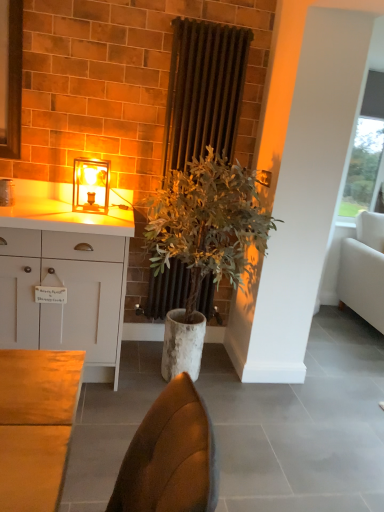
You are a GUI agent. You are given a task and a screenshot of the screen. Output one action in this format:
    pyautogui.click(x=<x>, y=<y>)
    Task: Click on the dark brown radiator at center
    This screenshot has width=384, height=512.
    Given the screenshot: What is the action you would take?
    pyautogui.click(x=203, y=91)

What do you see at coordinates (72, 296) in the screenshot?
I see `white matte cabinet at left` at bounding box center [72, 296].

You are a GUI agent. You are given a task and a screenshot of the screen. Output one action in this format:
    pyautogui.click(x=<x>, y=<y>)
    Task: Click on the white fabric couch at right
    The height and width of the screenshot is (512, 384).
    Given the screenshot: What is the action you would take?
    pyautogui.click(x=364, y=269)

Is green leafy plant at center not near dark brown radiator at center?

No, green leafy plant at center is not far from dark brown radiator at center.

Measure the distance from green leafy plant at center to dark brown radiator at center.

46.92 centimeters.

How different are the orientations of green leafy plant at center and dark brown radiator at center in degrees?

125 degrees separate the facing orientations of green leafy plant at center and dark brown radiator at center.

From the image's perspective, who appears lower, green leafy plant at center or dark brown radiator at center?

green leafy plant at center.

From the image's perspective, which one is positioned lower, dark brown radiator at center or green leafy plant at center?

green leafy plant at center appears lower in the image.

Is dark brown radiator at center facing towards green leafy plant at center?

No, dark brown radiator at center is not aimed at green leafy plant at center.

Between dark brown radiator at center and green leafy plant at center, which one has smaller width?

With smaller width is dark brown radiator at center.

Is dark brown radiator at center closer to camera compared to green leafy plant at center?

No, dark brown radiator at center is behind green leafy plant at center.

Where is `studio couch below the matte glass table lamp at upper left (from a real-world perspective)`? This screenshot has height=512, width=384. studio couch below the matte glass table lamp at upper left (from a real-world perspective) is located at coordinates (364, 269).

Is point (368, 279) behind point (96, 191)?

That is True.

Is the position of white fabric couch at right less distant than that of matte glass table lamp at upper left?

No, white fabric couch at right is further to the viewer.

Measure the distance from white fabric couch at right to matte glass table lamp at upper left.

white fabric couch at right is 7.57 feet away from matte glass table lamp at upper left.

From a real-world perspective, who is located higher, green leafy plant at center or white matte cabinet at left?

In real-world perspective, green leafy plant at center is above.

Is white matte cabinet at left completely or partially inside green leafy plant at center?

No, white matte cabinet at left is located outside of green leafy plant at center.

Who is taller, green leafy plant at center or white matte cabinet at left?

Standing taller between the two is green leafy plant at center.

Does green leafy plant at center turn towards white matte cabinet at left?

No, green leafy plant at center is not facing towards white matte cabinet at left.

From the image's perspective, which one is positioned lower, green leafy plant at center or matte glass table lamp at upper left?

From the image's view, green leafy plant at center is below.

Does point (191, 259) appear closer or farther from the camera than point (80, 187)?

Point (191, 259) is positioned closer to the camera compared to point (80, 187).

Can matte glass table lamp at upper left be found inside green leafy plant at center?

That's incorrect, matte glass table lamp at upper left is not inside green leafy plant at center.

Consider the image. How many degrees apart are the facing directions of green leafy plant at center and matte glass table lamp at upper left?

The facing directions of green leafy plant at center and matte glass table lamp at upper left are 2.8 degrees apart.

In the scene shown: Is white matte cabinet at left surrounded by matte glass table lamp at upper left?

No, white matte cabinet at left is not a part of matte glass table lamp at upper left.

Measure the distance from matte glass table lamp at upper left to white matte cabinet at left.

A distance of 18.96 inches exists between matte glass table lamp at upper left and white matte cabinet at left.

Can you confirm if matte glass table lamp at upper left is positioned to the right of white matte cabinet at left?

Correct, you'll find matte glass table lamp at upper left to the right of white matte cabinet at left.

Locate an element on the screen. cabinetry in front of the matte glass table lamp at upper left is located at coordinates (72, 296).

Which is behind, white matte cabinet at left or green leafy plant at center?

Positioned behind is white matte cabinet at left.

From a real-world perspective, between white matte cabinet at left and green leafy plant at center, who is vertically higher?

green leafy plant at center.

Which is correct: white matte cabinet at left is inside green leafy plant at center, or outside of it?

white matte cabinet at left exists outside the volume of green leafy plant at center.

How far apart are white matte cabinet at left and green leafy plant at center?

white matte cabinet at left is 18.87 inches from green leafy plant at center.

The width and height of the screenshot is (384, 512). I want to click on radiator that is on the left side of green leafy plant at center, so click(203, 91).

Locate an element on the screen. This screenshot has width=384, height=512. houseplant on the right of dark brown radiator at center is located at coordinates (206, 227).

Considering their positions, is white fabric couch at right positioned closer to dark brown radiator at center than matte glass table lamp at upper left?

matte glass table lamp at upper left lies closer to dark brown radiator at center than the other object.

Looking at the image, which one is located closer to green leafy plant at center, white fabric couch at right or dark brown radiator at center?

The object closer to green leafy plant at center is dark brown radiator at center.

Looking at the image, which one is located closer to white matte cabinet at left, dark brown radiator at center or white fabric couch at right?

dark brown radiator at center.

Estimate the real-world distances between objects in this image. Which object is closer to matte glass table lamp at upper left, dark brown radiator at center or white matte cabinet at left?

Among the two, white matte cabinet at left is located nearer to matte glass table lamp at upper left.

Considering their positions, is white matte cabinet at left positioned closer to white fabric couch at right than dark brown radiator at center?

dark brown radiator at center.

Considering their positions, is green leafy plant at center positioned further to dark brown radiator at center than white fabric couch at right?

white fabric couch at right lies further to dark brown radiator at center than the other object.

Looking at the image, which one is located closer to white fabric couch at right, white matte cabinet at left or matte glass table lamp at upper left?

Among the two, matte glass table lamp at upper left is located nearer to white fabric couch at right.

From the image, which object appears to be nearer to white matte cabinet at left, white fabric couch at right or matte glass table lamp at upper left?

matte glass table lamp at upper left lies closer to white matte cabinet at left than the other object.

At what (x,y) coordinates should I click in order to perform the action: click on table lamp situated between white matte cabinet at left and dark brown radiator at center from left to right. Please return your answer as a coordinate pair (x, y). The width and height of the screenshot is (384, 512). Looking at the image, I should click on (91, 185).

You are a GUI agent. You are given a task and a screenshot of the screen. Output one action in this format:
    pyautogui.click(x=<x>, y=<y>)
    Task: Click on the houseplant located between dark brown radiator at center and white fabric couch at right in the left-right direction
    This screenshot has width=384, height=512.
    Given the screenshot: What is the action you would take?
    pyautogui.click(x=206, y=227)

Where is `radiator between white matte cabinet at left and white fabric couch at right from left to right`? The image size is (384, 512). radiator between white matte cabinet at left and white fabric couch at right from left to right is located at coordinates (203, 91).

Where is `houseplant situated between white matte cabinet at left and white fabric couch at right from left to right`? The image size is (384, 512). houseplant situated between white matte cabinet at left and white fabric couch at right from left to right is located at coordinates (206, 227).